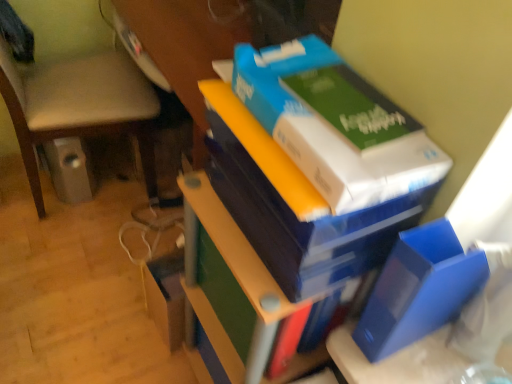
Locate an element on the screen. vacant area that is in front of beige fabric chair at lower left is located at coordinates (67, 269).